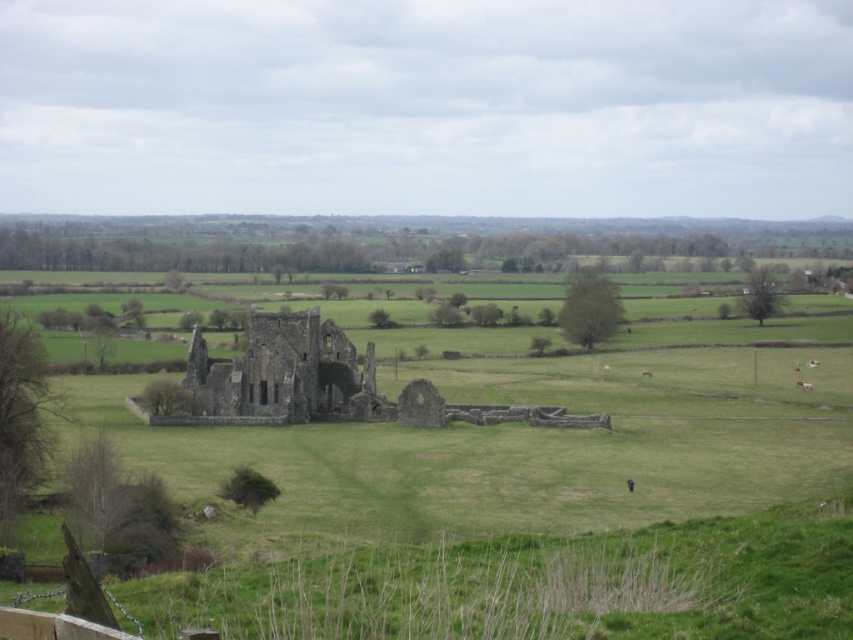
Can you confirm if brown stone ruins at center is wider than brown fuzzy sheep at lower right?

→ Indeed, brown stone ruins at center has a greater width compared to brown fuzzy sheep at lower right.

Between brown stone ruins at center and brown fuzzy sheep at lower right, which one appears on the right side from the viewer's perspective?

brown fuzzy sheep at lower right is more to the right.

Who is more distant from viewer, (308, 348) or (809, 360)?

Positioned behind is point (809, 360).

This screenshot has width=853, height=640. In order to click on brown stone ruins at center in this screenshot , I will do `click(287, 372)`.

Between green grassy field at center and brown stone ruins at center, which one is positioned higher?

brown stone ruins at center is higher up.

Does point (337, 605) lie in front of point (199, 330)?

Yes, it is.

Find the location of a particular element. The width and height of the screenshot is (853, 640). green grassy field at center is located at coordinates (471, 467).

Which of these two, green grassy field at center or brown fuzzy sheep at lower right, stands taller?

green grassy field at center is taller.

Can you confirm if green grassy field at center is shorter than brown fuzzy sheep at lower right?

In fact, green grassy field at center may be taller than brown fuzzy sheep at lower right.

The width and height of the screenshot is (853, 640). In order to click on green grassy field at center in this screenshot , I will do `click(471, 467)`.